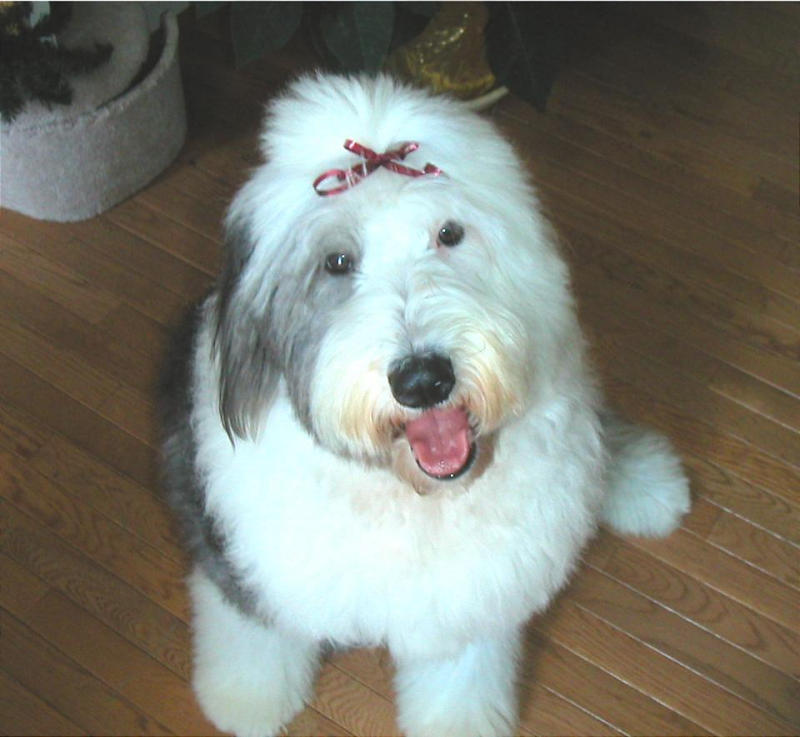
I want to click on plant, so click(37, 77).